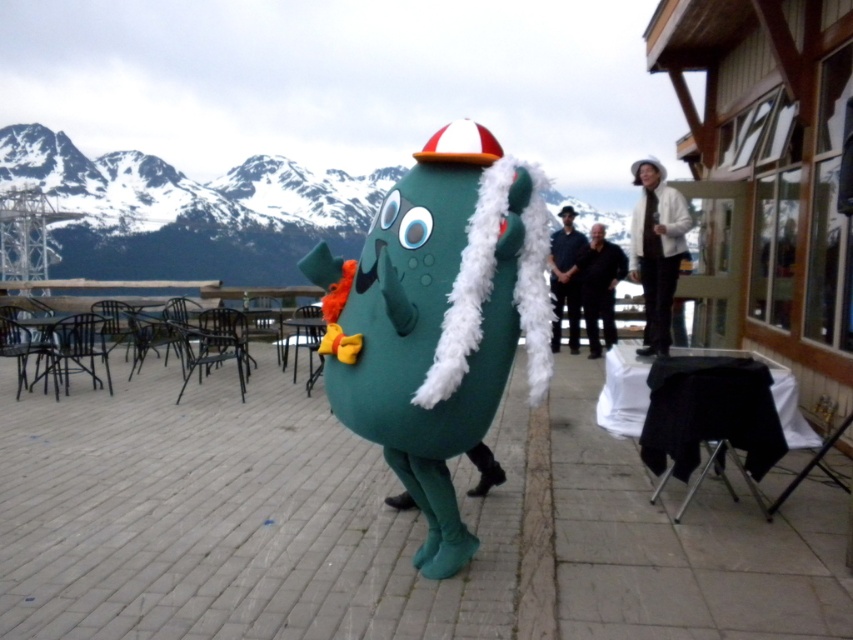
You are a photographer standing on the patio and want to take a photo of the teal plush toy at center and the black smooth pants at center. Which object should you focus on first if you want to capture both in the frame without moving the camera?

The teal plush toy at center is taller than the black smooth pants at center, so you should focus on the teal plush toy at center first to ensure it fits within the frame.

You are standing on the patio and see the teal plush toy at center and the black smooth pants at center. Which object is positioned to the left?

The teal plush toy at center is to the left of the black smooth pants at center.

You are a delivery robot with a 15 feet wide package. You need to place the package between the teal plush toy at center and the white woolen coat at upper right. Can you fit the package between them?

The teal plush toy at center and the white woolen coat at upper right are 17.86 feet apart. Since the package is 15 feet wide, it can fit between them as there is enough space.